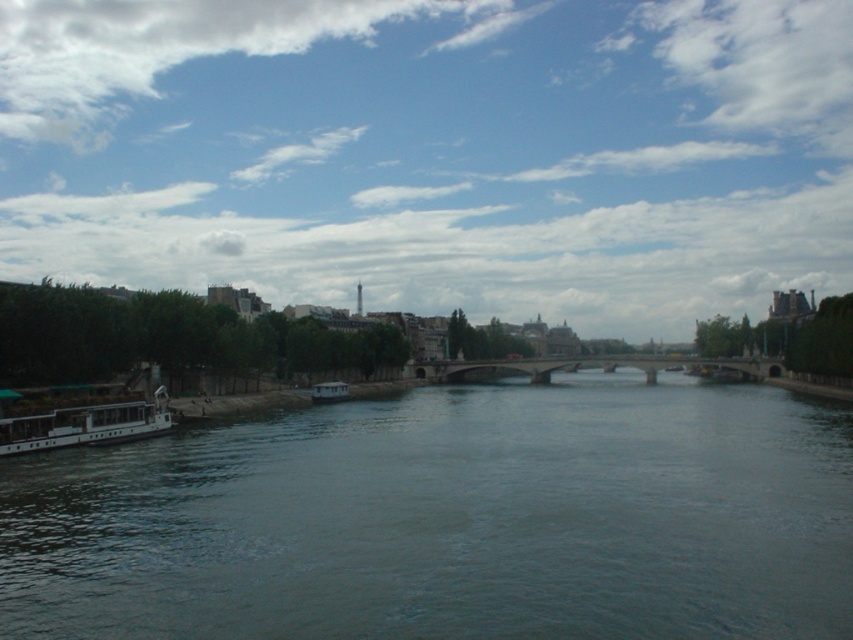
Question: Is dark gray water at center above white glossy boat at lower left?

Choices:
 (A) yes
 (B) no

Answer: (B)

Question: Is blue sky at upper center above white glossy boat at lower left?

Choices:
 (A) yes
 (B) no

Answer: (A)

Question: Which of the following is the closest to the observer?

Choices:
 (A) dark gray water at center
 (B) white matte boat at center

Answer: (A)

Question: Which object is the farthest from the dark gray water at center?

Choices:
 (A) white glossy boat at lower left
 (B) blue sky at upper center

Answer: (B)

Question: Is dark gray water at center thinner than white glossy boat at lower left?

Choices:
 (A) yes
 (B) no

Answer: (B)

Question: Which point is farther to the camera?

Choices:
 (A) (56, 413)
 (B) (73, 115)
 (C) (323, 401)

Answer: (B)